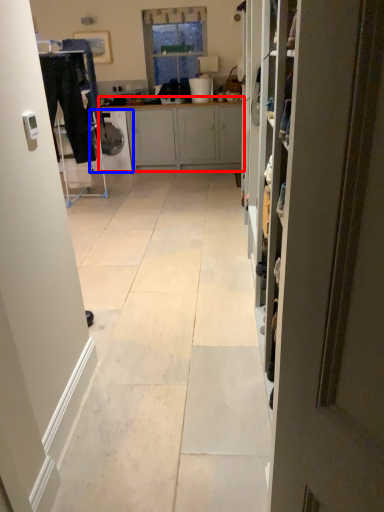
Question: Which of the following is the closest to the observer, cabinetry (highlighted by a red box) or dish washer (highlighted by a blue box)?

Choices:
 (A) cabinetry
 (B) dish washer

Answer: (A)